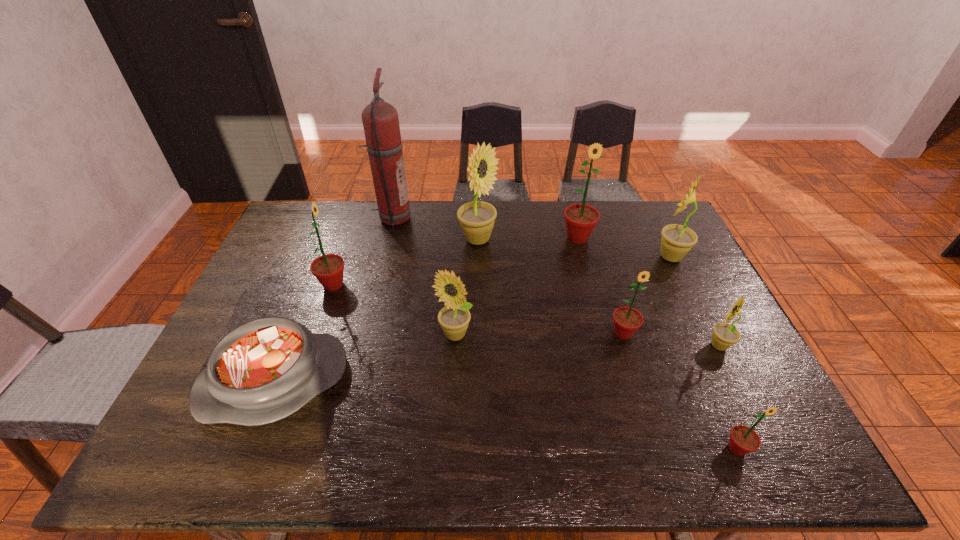
I want to click on the tallest object, so click(380, 119).

Find the location of a particular element. red fire extinguisher is located at coordinates (380, 119).

You are a GUI agent. You are given a task and a screenshot of the screen. Output one action in this format:
    pyautogui.click(x=<x>, y=<y>)
    Task: Click on the biggest yellow sunflower
    The image size is (960, 540).
    Given the screenshot: What is the action you would take?
    pyautogui.click(x=476, y=218)

Find the location of `the biggest green sunflower`. the biggest green sunflower is located at coordinates pyautogui.click(x=580, y=219).

You are a GUI agent. You are given a task and a screenshot of the screen. Output one action in this format:
    pyautogui.click(x=<x>, y=<y>)
    Task: Click on the third smallest yellow sunflower
    The height and width of the screenshot is (540, 960).
    Given the screenshot: What is the action you would take?
    (677, 240)

This screenshot has width=960, height=540. What are the coordinates of `the sixth nearest object` in the screenshot? It's located at (328, 269).

Where is `the third nearest green sunflower`? Image resolution: width=960 pixels, height=540 pixels. the third nearest green sunflower is located at coordinates (328, 269).

You are a GUI agent. You are given a task and a screenshot of the screen. Output one action in this format:
    pyautogui.click(x=<x>, y=<y>)
    Task: Click on the third farthest green sunflower
    
    Given the screenshot: What is the action you would take?
    pyautogui.click(x=627, y=320)

Where is `the third biggest yellow sunflower`? This screenshot has width=960, height=540. the third biggest yellow sunflower is located at coordinates (454, 318).

Where is `the smallest yellow sunflower`? The width and height of the screenshot is (960, 540). the smallest yellow sunflower is located at coordinates (724, 335).